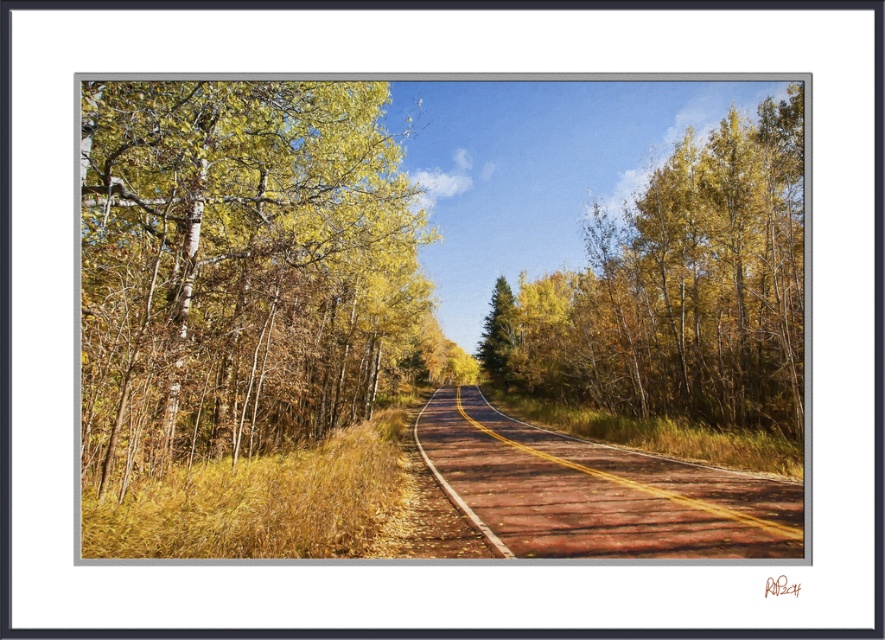
Question: Which point appears farthest from the camera in this image?

Choices:
 (A) (96, 326)
 (B) (717, 480)
 (C) (781, 432)
 (D) (495, 308)

Answer: (D)

Question: In this image, where is yellow/golden bark trees at upper center located relative to green matte tree at center?

Choices:
 (A) below
 (B) above

Answer: (B)

Question: Is smooth bark birch at left below green matte tree at center?

Choices:
 (A) yes
 (B) no

Answer: (B)

Question: Based on their relative distances, which object is farther from the yellow/golden bark trees at upper center?

Choices:
 (A) brown wooden road at center
 (B) green matte tree at center
 (C) smooth bark birch at left

Answer: (B)

Question: Which object is the farthest from the smooth bark birch at left?

Choices:
 (A) brown wooden road at center
 (B) yellow/golden bark trees at upper center
 (C) green matte tree at center

Answer: (C)

Question: Does smooth bark birch at left appear on the right side of brown wooden road at center?

Choices:
 (A) no
 (B) yes

Answer: (A)